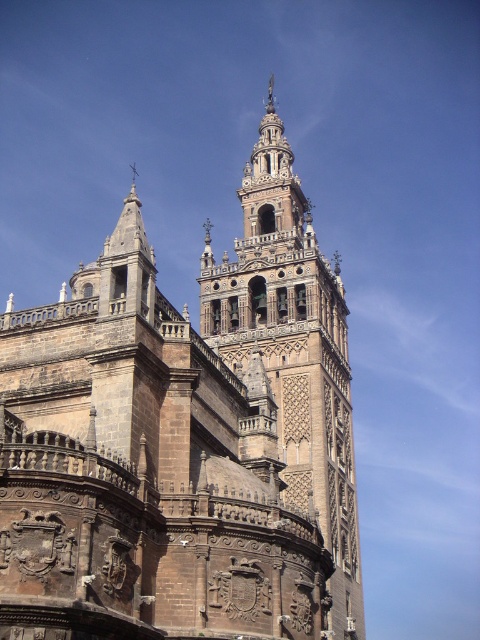
Question: Which point is farther to the camera?

Choices:
 (A) brown stone tower at center
 (B) brown stone church at center

Answer: (A)

Question: Can you confirm if brown stone church at center is positioned above brown stone tower at center?

Choices:
 (A) no
 (B) yes

Answer: (A)

Question: Among these points, which one is nearest to the camera?

Choices:
 (A) (262, 205)
 (B) (54, 449)

Answer: (B)

Question: Where is brown stone church at center located in relation to brown stone tower at center in the image?

Choices:
 (A) left
 (B) right

Answer: (A)

Question: From the image, what is the correct spatial relationship of brown stone church at center in relation to brown stone tower at center?

Choices:
 (A) left
 (B) right

Answer: (A)